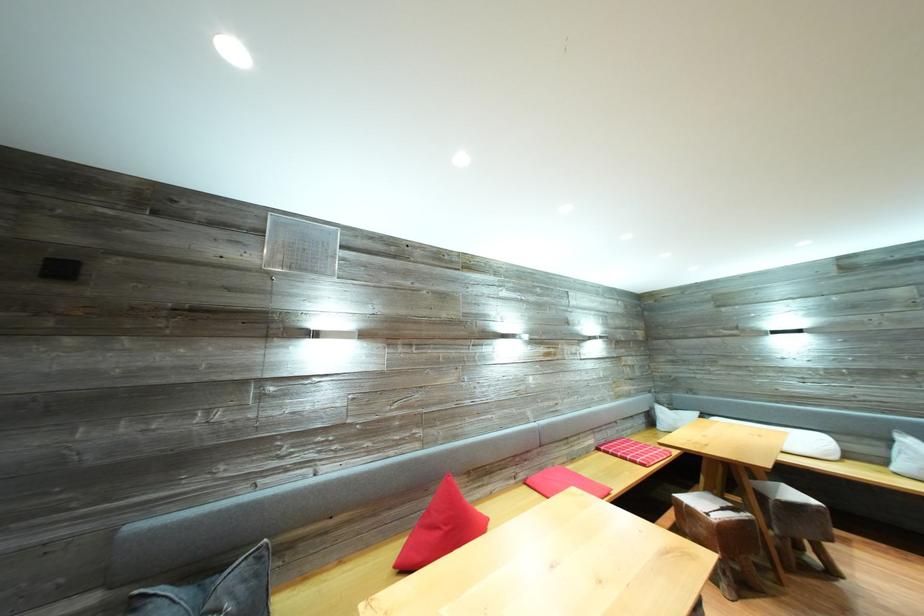
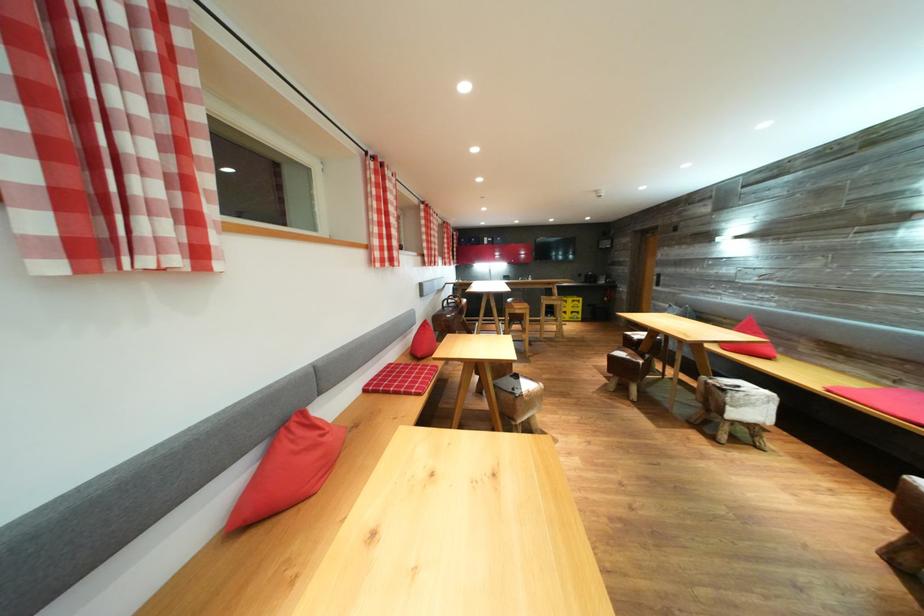
Locate, in the second image, the point that corresponds to (520,487) in the first image.

(895, 389)